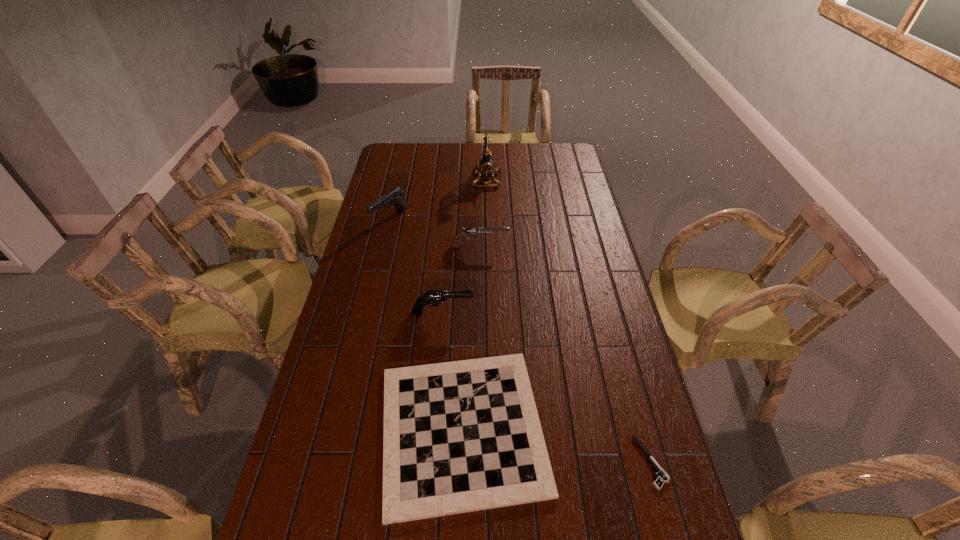
Image resolution: width=960 pixels, height=540 pixels. I want to click on the shortest object, so click(663, 477).

At what (x,y) coordinates should I click in order to perform the action: click on vacant space located on the front of the farthest object, featuring the rotary dial. Please return your answer as a coordinate pair (x, y). The height and width of the screenshot is (540, 960). Looking at the image, I should click on (454, 180).

The image size is (960, 540). Find the location of `free space located on the front of the farthest object, featuring the rotary dial`. free space located on the front of the farthest object, featuring the rotary dial is located at coordinates (454, 180).

This screenshot has height=540, width=960. I want to click on vacant space located 0.060m on the front of the farthest object, featuring the rotary dial, so click(x=459, y=180).

Find the location of a particular element. vacant area situated at the muzzle of the farthest gun is located at coordinates (379, 265).

You are a GUI agent. You are given a task and a screenshot of the screen. Output one action in this format:
    pyautogui.click(x=<x>, y=<y>)
    Task: Click on the vacant region located 0.280m at the end of the barrel of the third nearest object
    This screenshot has height=540, width=960.
    Given the screenshot: What is the action you would take?
    pyautogui.click(x=560, y=313)

Image resolution: width=960 pixels, height=540 pixels. In order to click on blank area located aiming along the barrel of the third farthest object in this screenshot , I will do `click(550, 246)`.

Identify the location of free space located on the left of the checkerboard. This screenshot has height=540, width=960. (341, 429).

Where is `free space located 0.310m on the front-facing side of the shortest object`? free space located 0.310m on the front-facing side of the shortest object is located at coordinates [x=513, y=462].

In order to click on free region located on the front-facing side of the shortest object in this screenshot , I will do `click(545, 462)`.